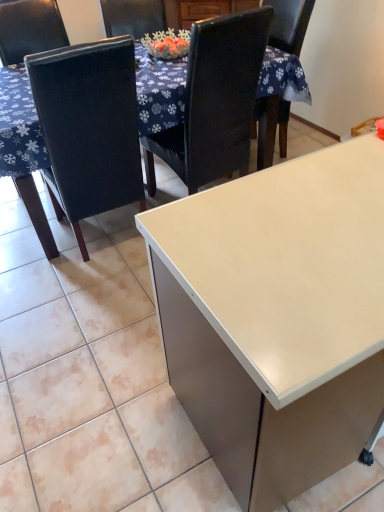
Locate an element on the screen. The image size is (384, 512). matte black chair at left, the 2th chair from the right is located at coordinates (89, 128).

Describe the element at coordinates (89, 128) in the screenshot. This screenshot has height=512, width=384. I see `matte black chair at left, the 2th chair from the right` at that location.

The image size is (384, 512). I want to click on black leather chair at upper center, placed as the 1th chair when sorted from right to left, so click(x=219, y=104).

Looking at this image, is white glossy table at upper center positioned far away from black leather chair at upper center, which ranks as the second chair in left-to-right order?

white glossy table at upper center is actually quite close to black leather chair at upper center, which ranks as the second chair in left-to-right order.

Is point (290, 93) positioned in front of point (267, 151)?

Yes, point (290, 93) is in front of point (267, 151).

Looking at the image, does white glossy table at upper center seem bigger or smaller compared to black leather chair at upper center, placed as the 1th chair when sorted from right to left?

Considering their sizes, white glossy table at upper center takes up more space than black leather chair at upper center, placed as the 1th chair when sorted from right to left.

Where is `the 2nd chair above the white glossy table at upper center (from a real-world perspective)`? The image size is (384, 512). the 2nd chair above the white glossy table at upper center (from a real-world perspective) is located at coordinates (219, 104).

Measure the distance between white glossy table at upper center and white glossy desk at center.

They are 1.34 meters apart.

Would you say white glossy table at upper center is to the left or to the right of white glossy desk at center in the picture?

white glossy table at upper center is positioned on white glossy desk at center's left side.

Is white glossy table at upper center surrounding white glossy desk at center?

No, white glossy desk at center is not inside white glossy table at upper center.

Which of these two, white glossy table at upper center or white glossy desk at center, is thinner?

With smaller width is white glossy desk at center.

In terms of height, does black leather chair at upper center, which ranks as the second chair in left-to-right order, look taller or shorter compared to white glossy desk at center?

black leather chair at upper center, which ranks as the second chair in left-to-right order, is taller than white glossy desk at center.

Is black leather chair at upper center, which ranks as the second chair in left-to-right order, facing away from white glossy desk at center?

Correct, black leather chair at upper center, which ranks as the second chair in left-to-right order, is looking away from white glossy desk at center.

From the image's perspective, between black leather chair at upper center, placed as the 1th chair when sorted from right to left, and white glossy desk at center, which one is located above?

black leather chair at upper center, placed as the 1th chair when sorted from right to left, from the image's perspective.

From a real-world perspective, who is located higher, matte black chair at left, the first chair when ordered from left to right, or white glossy table at upper center?

matte black chair at left, the first chair when ordered from left to right.

Is matte black chair at left, the 2th chair from the right, shorter than white glossy table at upper center?

Incorrect, the height of matte black chair at left, the 2th chair from the right, does not fall short of that of white glossy table at upper center.

Is matte black chair at left, the 2th chair from the right, oriented away from white glossy table at upper center?

Correct, matte black chair at left, the 2th chair from the right, is looking away from white glossy table at upper center.

Considering the relative sizes of black leather chair at upper center, which ranks as the second chair in left-to-right order, and matte black chair at left, the first chair when ordered from left to right, in the image provided, is black leather chair at upper center, which ranks as the second chair in left-to-right order, thinner than matte black chair at left, the first chair when ordered from left to right,?

Yes, black leather chair at upper center, which ranks as the second chair in left-to-right order, is thinner than matte black chair at left, the first chair when ordered from left to right.

Between black leather chair at upper center, which ranks as the second chair in left-to-right order, and matte black chair at left, the first chair when ordered from left to right, which one has less height?

With less height is matte black chair at left, the first chair when ordered from left to right.

Is black leather chair at upper center, which ranks as the second chair in left-to-right order, next to matte black chair at left, the 2th chair from the right?

No, black leather chair at upper center, which ranks as the second chair in left-to-right order, is not making contact with matte black chair at left, the 2th chair from the right.

Consider the image. From a real-world perspective, is black leather chair at upper center, which ranks as the second chair in left-to-right order, physically above matte black chair at left, the first chair when ordered from left to right?

Yes.

Which is farther, (90, 119) or (233, 135)?

Positioned behind is point (233, 135).

From the picture: Is matte black chair at left, the 2th chair from the right, facing away from black leather chair at upper center, which ranks as the second chair in left-to-right order?

No, matte black chair at left, the 2th chair from the right, is not facing the opposite direction of black leather chair at upper center, which ranks as the second chair in left-to-right order.

Is matte black chair at left, the 2th chair from the right, smaller than black leather chair at upper center, which ranks as the second chair in left-to-right order?

Indeed, matte black chair at left, the 2th chair from the right, has a smaller size compared to black leather chair at upper center, which ranks as the second chair in left-to-right order.

Is the depth of white glossy table at upper center less than that of matte black chair at left, the first chair when ordered from left to right?

No, it is not.

From the picture: Measure the distance from white glossy table at upper center to matte black chair at left, the 2th chair from the right.

The distance of white glossy table at upper center from matte black chair at left, the 2th chair from the right, is 10.98 inches.

Where is `chair below the white glossy table at upper center (from the image's perspective)`? chair below the white glossy table at upper center (from the image's perspective) is located at coordinates (89, 128).

Is white glossy table at upper center at the right side of matte black chair at left, the first chair when ordered from left to right?

Correct, you'll find white glossy table at upper center to the right of matte black chair at left, the first chair when ordered from left to right.

The width and height of the screenshot is (384, 512). Identify the location of chair above the white glossy table at upper center (from the image's perspective). (219, 104).

In order to click on desk above the white glossy table at upper center (from a real-world perspective) in this screenshot , I will do `click(277, 317)`.

From the image, which object appears to be farther from white glossy desk at center, black leather chair at upper center, placed as the 1th chair when sorted from right to left, or white glossy table at upper center?

Based on the image, white glossy table at upper center appears to be further to white glossy desk at center.

Considering their positions, is matte black chair at left, the first chair when ordered from left to right, positioned closer to black leather chair at upper center, which ranks as the second chair in left-to-right order, than white glossy table at upper center?

Among the two, matte black chair at left, the first chair when ordered from left to right, is located nearer to black leather chair at upper center, which ranks as the second chair in left-to-right order.

Estimate the real-world distances between objects in this image. Which object is closer to matte black chair at left, the 2th chair from the right, white glossy desk at center or black leather chair at upper center, which ranks as the second chair in left-to-right order?

black leather chair at upper center, which ranks as the second chair in left-to-right order.

Estimate the real-world distances between objects in this image. Which object is closer to white glossy table at upper center, black leather chair at upper center, placed as the 1th chair when sorted from right to left, or matte black chair at left, the 2th chair from the right?

matte black chair at left, the 2th chair from the right.

When comparing their distances from black leather chair at upper center, which ranks as the second chair in left-to-right order, does white glossy table at upper center or white glossy desk at center seem further?

white glossy desk at center.

Estimate the real-world distances between objects in this image. Which object is closer to white glossy table at upper center, matte black chair at left, the first chair when ordered from left to right, or white glossy desk at center?

Based on the image, matte black chair at left, the first chair when ordered from left to right, appears to be nearer to white glossy table at upper center.

From the image, which object appears to be farther from matte black chair at left, the 2th chair from the right, white glossy table at upper center or white glossy desk at center?

white glossy desk at center is further to matte black chair at left, the 2th chair from the right.

Considering their positions, is black leather chair at upper center, placed as the 1th chair when sorted from right to left, positioned closer to white glossy table at upper center than white glossy desk at center?

black leather chair at upper center, placed as the 1th chair when sorted from right to left, is closer to white glossy table at upper center.

Identify the location of table between matte black chair at left, the 2th chair from the right, and white glossy desk at center, in the horizontal direction. This screenshot has height=512, width=384. (19, 126).

The width and height of the screenshot is (384, 512). Find the location of `table between matte black chair at left, the 2th chair from the right, and black leather chair at upper center, placed as the 1th chair when sorted from right to left, from left to right`. table between matte black chair at left, the 2th chair from the right, and black leather chair at upper center, placed as the 1th chair when sorted from right to left, from left to right is located at coordinates (19, 126).

The image size is (384, 512). I want to click on chair between white glossy desk at center and black leather chair at upper center, which ranks as the second chair in left-to-right order, in the front-back direction, so click(x=89, y=128).